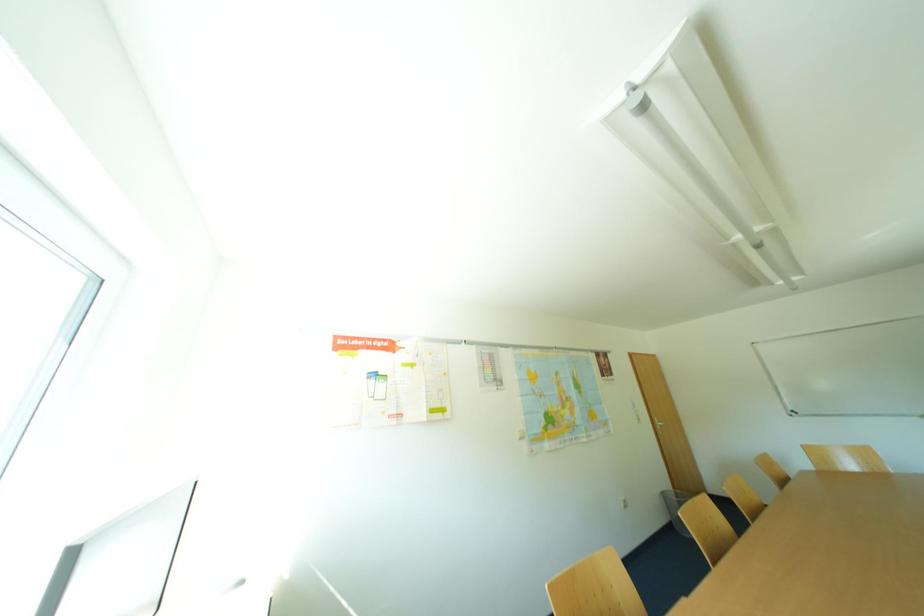
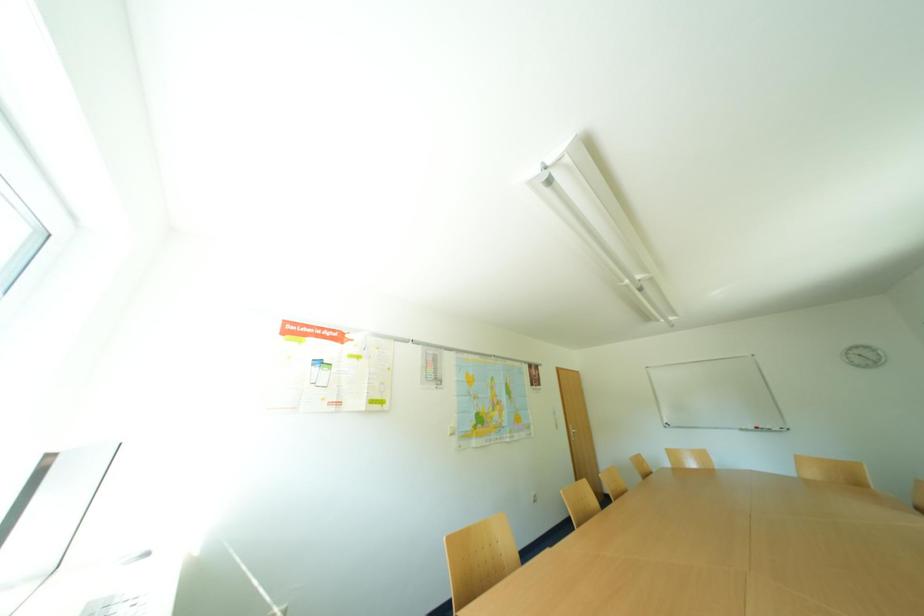
Question: The images are taken continuously from a first-person perspective. In which direction is your viewpoint rotating?

Choices:
 (A) Left
 (B) Right
 (C) Up
 (D) Down

Answer: (B)